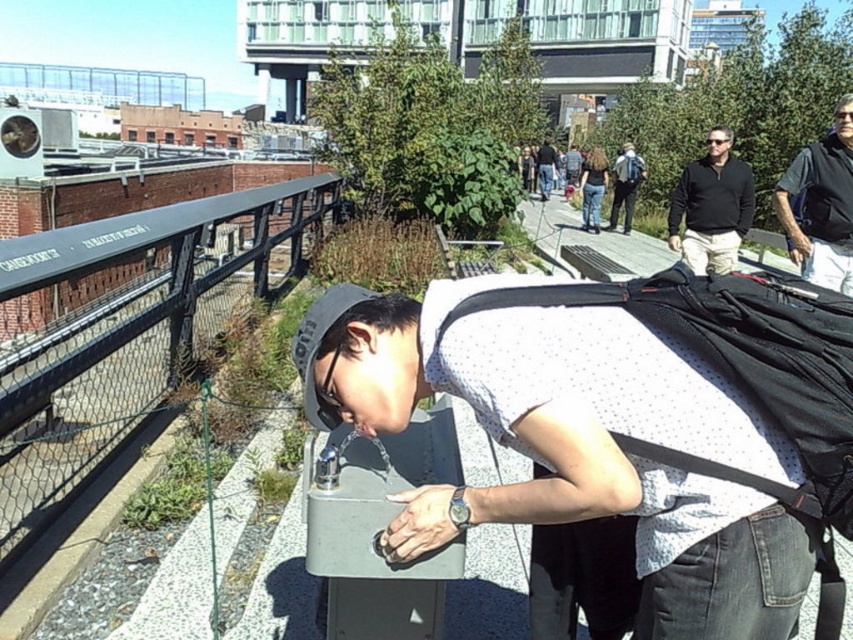
Does dark gray shirt at upper right have a greater width compared to matte black backpack at center?

Incorrect, dark gray shirt at upper right's width does not surpass matte black backpack at center's.

What do you see at coordinates (822, 204) in the screenshot? I see `dark gray shirt at upper right` at bounding box center [822, 204].

This screenshot has width=853, height=640. What are the coordinates of `dark gray shirt at upper right` in the screenshot? It's located at (822, 204).

Measure the distance between dark gray shirt at upper right and denim jeans at center.

A distance of 12.03 meters exists between dark gray shirt at upper right and denim jeans at center.

Which is behind, point (848, 132) or point (585, 228)?

The point (585, 228) is more distant.

Find the location of a particular element. The width and height of the screenshot is (853, 640). dark gray shirt at upper right is located at coordinates (822, 204).

Is point (3, 392) closer to camera compared to point (549, 145)?

That is True.

Does black metal rail at left appear under dark blue jeans at center?

Yes, black metal rail at left is below dark blue jeans at center.

What do you see at coordinates (128, 333) in the screenshot? I see `black metal rail at left` at bounding box center [128, 333].

At what (x,y) coordinates should I click in order to perform the action: click on black metal rail at left. Please return your answer as a coordinate pair (x, y). Looking at the image, I should click on (128, 333).